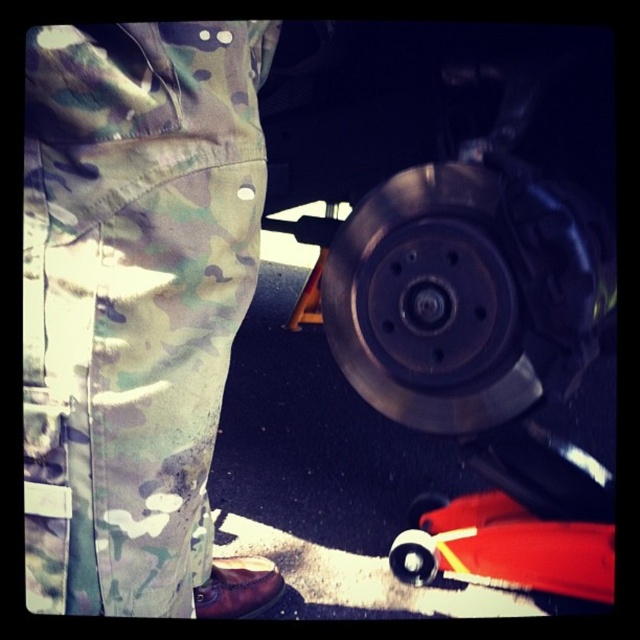
Question: Based on their relative distances, which object is nearer to the camo fabric pants at left?

Choices:
 (A) rubberized red toy car at lower right
 (B) metallic brake disc at center

Answer: (A)

Question: Based on their relative distances, which object is nearer to the metallic brake disc at lower right?

Choices:
 (A) rubberized red toy car at lower right
 (B) metallic brake disc at center

Answer: (A)

Question: Can you confirm if metallic brake disc at lower right is positioned to the left of metallic brake disc at center?

Choices:
 (A) yes
 (B) no

Answer: (A)

Question: Which object appears farthest from the camera in this image?

Choices:
 (A) metallic brake disc at lower right
 (B) rubberized red toy car at lower right
 (C) metallic brake disc at center

Answer: (C)

Question: Does camo fabric pants at left have a smaller size compared to rubberized red toy car at lower right?

Choices:
 (A) no
 (B) yes

Answer: (A)

Question: Does metallic brake disc at lower right have a greater width compared to metallic brake disc at center?

Choices:
 (A) yes
 (B) no

Answer: (A)